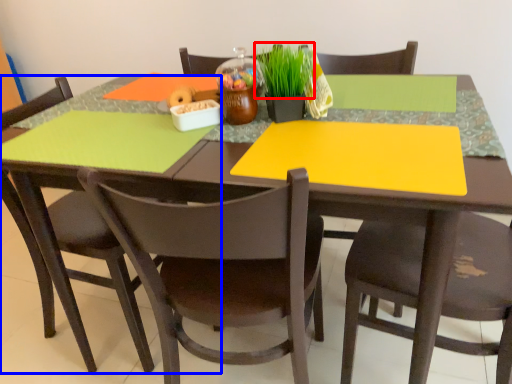
Question: Which point is closer to the camera, plant (highlighted by a red box) or chair (highlighted by a blue box)?

Choices:
 (A) plant
 (B) chair

Answer: (A)